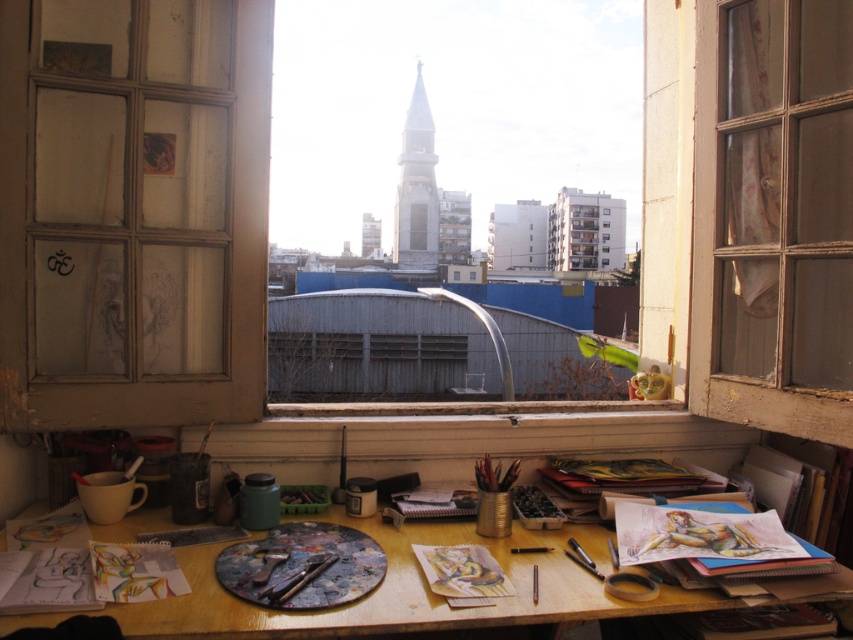
Question: Which point is closer to the camera?

Choices:
 (A) wooden window frame at left
 (B) wooden table at center
 (C) wooden frame at center

Answer: (B)

Question: Considering the relative positions of wooden frame at center and wooden table at center in the image provided, where is wooden frame at center located with respect to wooden table at center?

Choices:
 (A) right
 (B) left

Answer: (A)

Question: Which of the following is the closest to the observer?

Choices:
 (A) (837, 97)
 (B) (190, 568)

Answer: (B)

Question: Which is farther from the wooden frame at center?

Choices:
 (A) wooden window frame at left
 (B) wooden table at center

Answer: (A)

Question: Can you confirm if wooden window frame at left is bigger than wooden table at center?

Choices:
 (A) yes
 (B) no

Answer: (B)

Question: Is wooden window frame at left bigger than wooden frame at center?

Choices:
 (A) no
 (B) yes

Answer: (B)